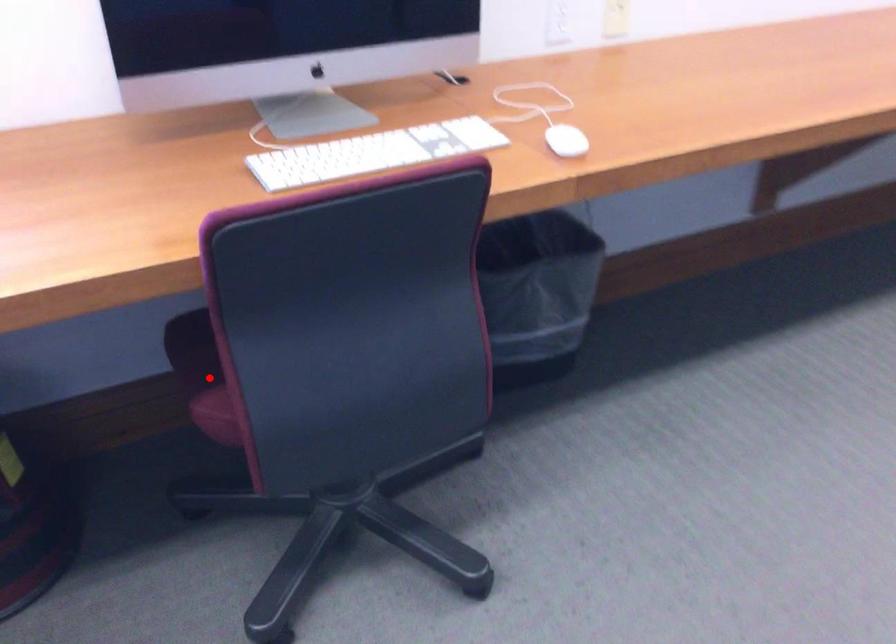
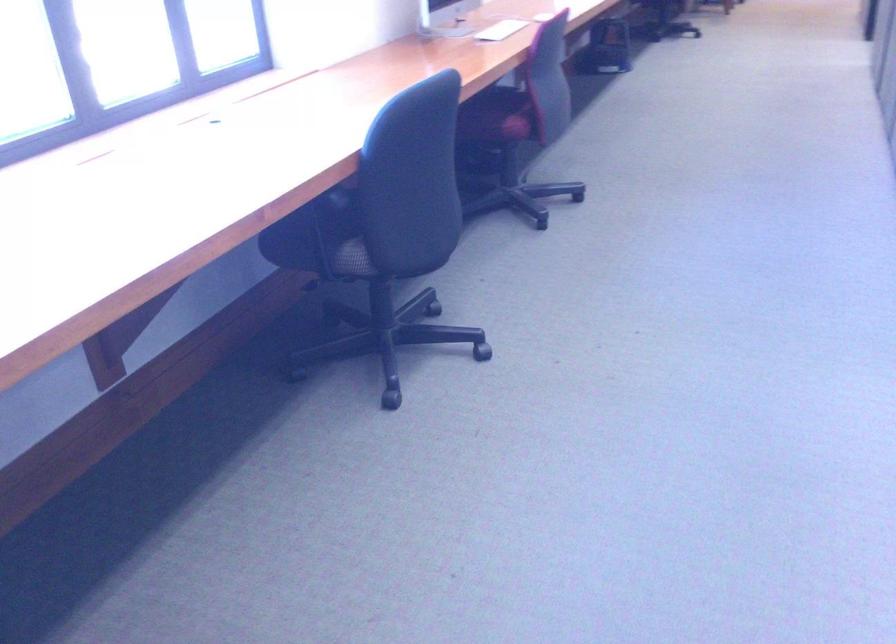
Question: I am providing you with two images of the same scene from different viewpoints. A red point is shown in image1. For the corresponding object point in image2, is it positioned nearer or farther from the camera?

Choices:
 (A) Nearer
 (B) Farther

Answer: (B)